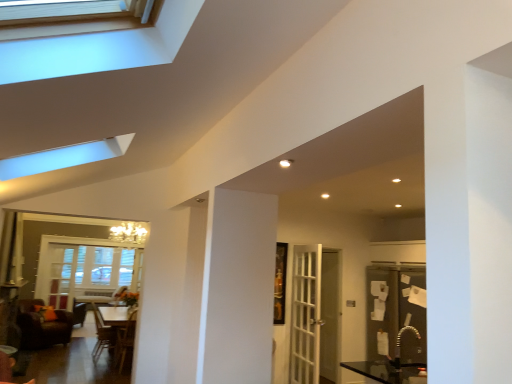
Question: From the image's perspective, would you say white glass window at lower left, the second window positioned from the right, is shown under dark brown leather armchair at center, marked as the 2th armchair in a right-to-left arrangement?

Choices:
 (A) yes
 (B) no

Answer: (B)

Question: Is white glass window at lower left, which is counted as the first window, starting from the bottom, at the right side of dark brown leather armchair at center, marked as the 2th armchair in a right-to-left arrangement?

Choices:
 (A) no
 (B) yes

Answer: (A)

Question: Is white glass window at lower left, the second window in the top-to-bottom sequence, at the left side of dark brown leather armchair at center, marked as the 2th armchair in a right-to-left arrangement?

Choices:
 (A) no
 (B) yes

Answer: (B)

Question: Is dark brown leather armchair at center, the first armchair viewed from the left, surrounded by white glass window at lower left, which ranks as the second window in front-to-back order?

Choices:
 (A) no
 (B) yes

Answer: (A)

Question: From the image's perspective, is white glass window at lower left, which ranks as the second window in front-to-back order, located above dark brown leather armchair at center, marked as the 2th armchair in a right-to-left arrangement?

Choices:
 (A) yes
 (B) no

Answer: (A)

Question: Considering the relative positions of white glass window at lower left, the second window in the top-to-bottom sequence, and dark brown leather armchair at center, the first armchair viewed from the left, in the image provided, is white glass window at lower left, the second window in the top-to-bottom sequence, behind dark brown leather armchair at center, the first armchair viewed from the left,?

Choices:
 (A) no
 (B) yes

Answer: (B)

Question: From the image's perspective, is clear glass window at upper left, which is the first window in top-to-bottom order, beneath clear glass screen door at center?

Choices:
 (A) yes
 (B) no

Answer: (B)

Question: Is there a large distance between clear glass window at upper left, which is the first window in top-to-bottom order, and clear glass screen door at center?

Choices:
 (A) no
 (B) yes

Answer: (B)

Question: Is clear glass window at upper left, marked as the 2th window in a back-to-front arrangement, oriented towards clear glass screen door at center?

Choices:
 (A) no
 (B) yes

Answer: (A)

Question: Is clear glass screen door at center at the back of clear glass window at upper left, marked as the 1th window in a right-to-left arrangement?

Choices:
 (A) yes
 (B) no

Answer: (B)

Question: Does clear glass window at upper left, marked as the 2th window in a back-to-front arrangement, appear on the left side of clear glass screen door at center?

Choices:
 (A) no
 (B) yes

Answer: (B)

Question: Are clear glass window at upper left, marked as the 1th window in a right-to-left arrangement, and clear glass screen door at center beside each other?

Choices:
 (A) no
 (B) yes

Answer: (A)

Question: Is clear glass window at upper left, marked as the 2th window in a back-to-front arrangement, wider than brown leather chair at lower left?

Choices:
 (A) no
 (B) yes

Answer: (A)